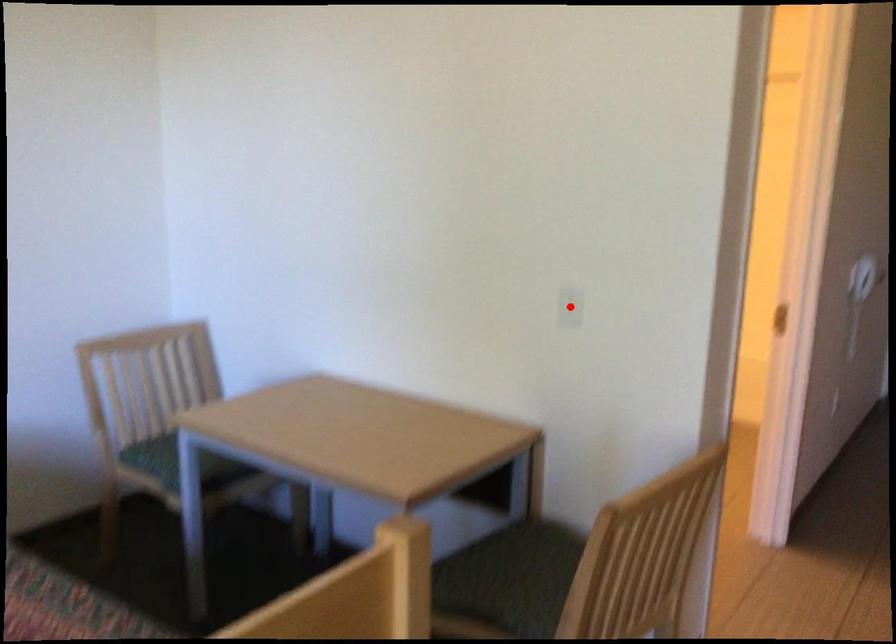
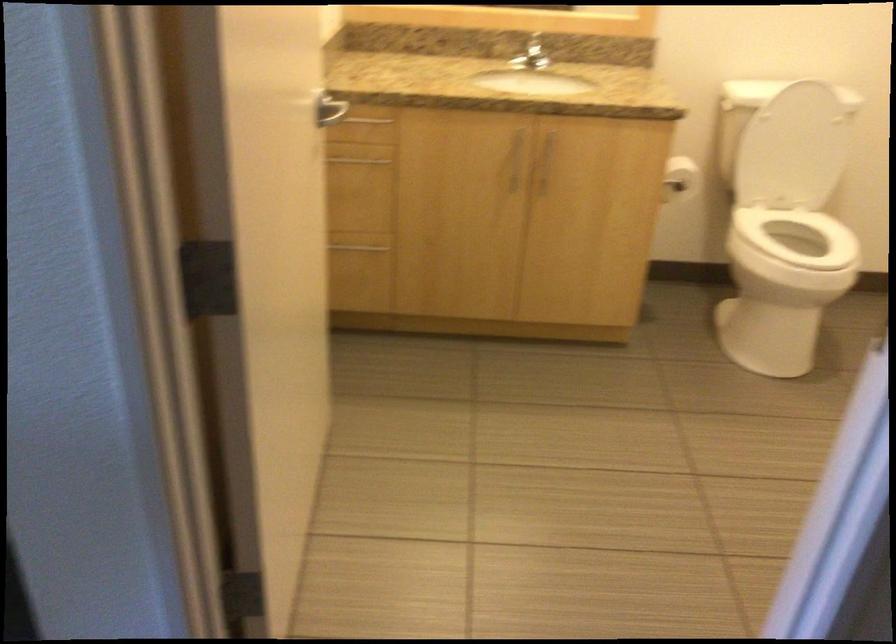
Question: I am providing you with two images of the same scene from different viewpoints. A red point is marked on the first image. At the location where the point appears in image 1, is it still visible in image 2?

Choices:
 (A) Yes
 (B) No

Answer: (B)